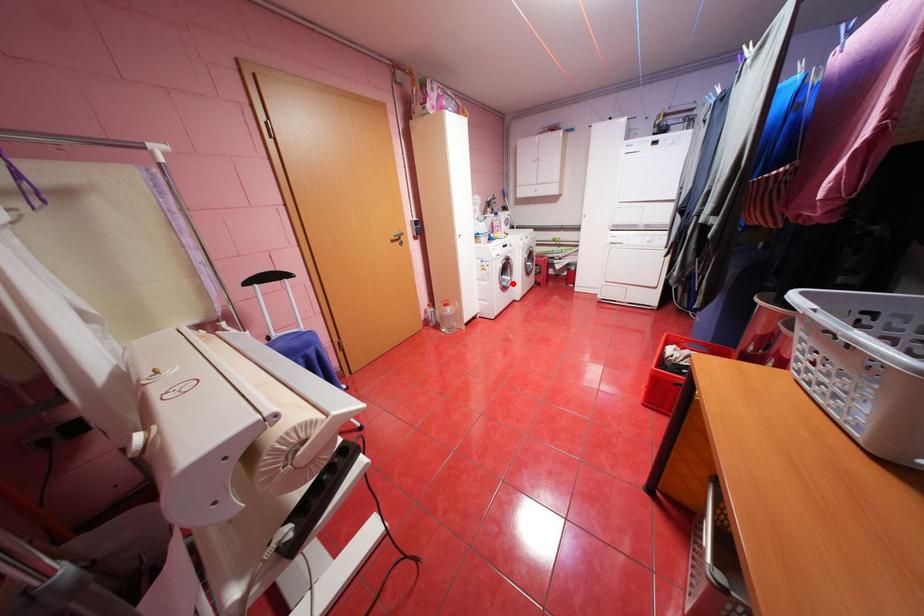
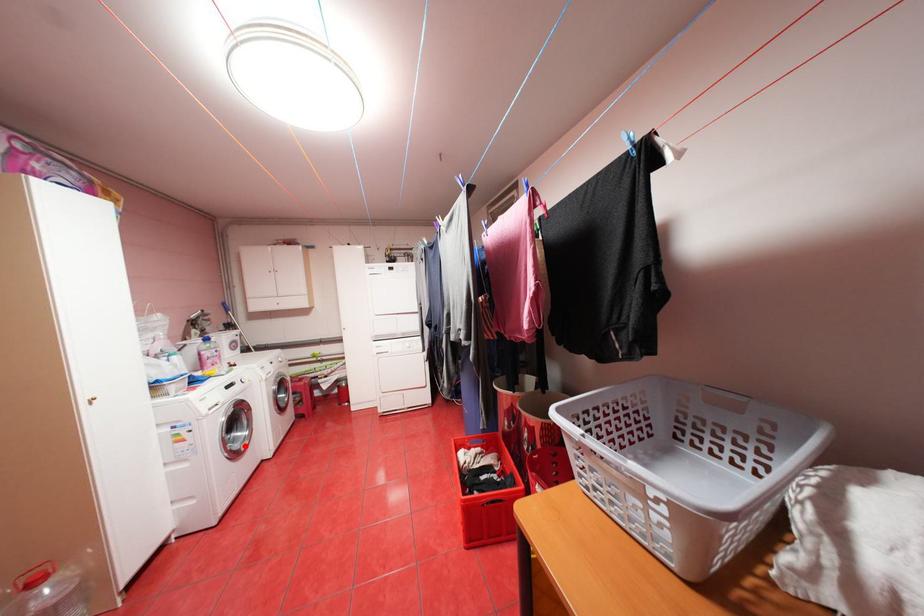
I am providing you with two images of the same scene from different viewpoints. A red point is marked on the first image and another point is marked on the second image. Is the marked point in image1 the same physical position as the marked point in image2?

Yes